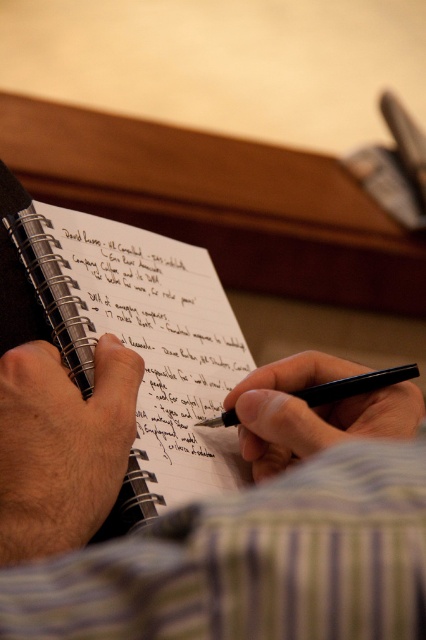
Can you confirm if striped fabric shirt at center is taller than smooth skin hand at center?

Indeed, striped fabric shirt at center has a greater height compared to smooth skin hand at center.

Based on the photo, does striped fabric shirt at center have a smaller size compared to smooth skin hand at center?

Actually, striped fabric shirt at center might be larger than smooth skin hand at center.

Who is more distant from viewer, (121, 349) or (17, 378)?

The point (121, 349) is behind.

You are a GUI agent. You are given a task and a screenshot of the screen. Output one action in this format:
    pyautogui.click(x=<x>, y=<y>)
    Task: Click on the striped fabric shirt at center
    
    Given the screenshot: What is the action you would take?
    pyautogui.click(x=213, y=513)

Does spiral-bound paper at center come behind black metallic pen at center?

No.

Which is more to the left, spiral-bound paper at center or black metallic pen at center?

→ Positioned to the left is spiral-bound paper at center.

Which is in front, point (154, 387) or point (204, 426)?

Point (154, 387) is more forward.

You are a GUI agent. You are given a task and a screenshot of the screen. Output one action in this format:
    pyautogui.click(x=<x>, y=<y>)
    Task: Click on the spiral-bound paper at center
    The height and width of the screenshot is (640, 426).
    Given the screenshot: What is the action you would take?
    pyautogui.click(x=143, y=346)

Is striped fabric shirt at center to the left of spiral-bound paper at center from the viewer's perspective?

Incorrect, striped fabric shirt at center is not on the left side of spiral-bound paper at center.

Is point (218, 579) farther from camera compared to point (245, 342)?

No, it is in front of (245, 342).

The height and width of the screenshot is (640, 426). What are the coordinates of `striped fabric shirt at center` in the screenshot? It's located at (213, 513).